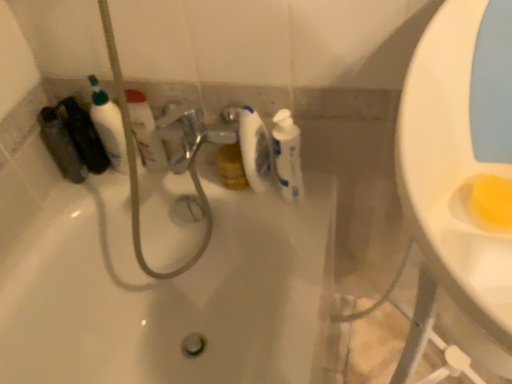
At what (x,y) coordinates should I click in order to perform the action: click on white glossy bottle at center, marked as the first cleaning product in a right-to-left arrangement. Please return your answer as a coordinate pair (x, y). This screenshot has height=384, width=512. Looking at the image, I should click on (287, 155).

This screenshot has height=384, width=512. I want to click on white glossy toilet paper at center, so click(254, 149).

In order to face white glossy bottle at upper left, arranged as the 1th cleaning product when viewed from the left, should I rotate leftwards or rightwards?

Turn left by 15.005 degrees to look at white glossy bottle at upper left, arranged as the 1th cleaning product when viewed from the left.

Describe the element at coordinates (145, 131) in the screenshot. I see `white glossy bottle at upper left, arranged as the 1th cleaning product when viewed from the left` at that location.

At what (x,y) coordinates should I click in order to perform the action: click on white glossy bottle at center, the second cleaning product from the left. Please return your answer as a coordinate pair (x, y). The width and height of the screenshot is (512, 384). Looking at the image, I should click on (287, 155).

Can you confirm if translucent plastic mouthwash at left is smaller than white glossy toilet paper at center?

Actually, translucent plastic mouthwash at left might be larger than white glossy toilet paper at center.

Is translucent plastic mouthwash at left positioned far away from white glossy toilet paper at center?

translucent plastic mouthwash at left is near white glossy toilet paper at center, not far away.

Is translucent plastic mouthwash at left facing away from white glossy toilet paper at center?

That's not correct — translucent plastic mouthwash at left is not looking away from white glossy toilet paper at center.

Is point (239, 140) positioned after point (141, 94)?

Yes.

Would you say white glossy toilet paper at center is inside or outside white glossy bottle at upper left, which ranks as the second cleaning product in right-to-left order?

white glossy toilet paper at center cannot be found inside white glossy bottle at upper left, which ranks as the second cleaning product in right-to-left order.

Which is more to the right, white glossy toilet paper at center or white glossy bottle at upper left, arranged as the 1th cleaning product when viewed from the left?

white glossy toilet paper at center is more to the right.

Can you tell me how much white glossy toilet paper at center and white glossy bottle at upper left, which ranks as the second cleaning product in right-to-left order, differ in facing direction?

The angle between the facing direction of white glossy toilet paper at center and the facing direction of white glossy bottle at upper left, which ranks as the second cleaning product in right-to-left order, is 0.128 degrees.

Can you confirm if translucent plastic mouthwash at left is bigger than white glossy bottle at upper left, which ranks as the second cleaning product in right-to-left order?

Correct, translucent plastic mouthwash at left is larger in size than white glossy bottle at upper left, which ranks as the second cleaning product in right-to-left order.

Is translucent plastic mouthwash at left shorter than white glossy bottle at upper left, which ranks as the second cleaning product in right-to-left order?

Yes.

From the translucent plastic mouthwash at left, count 1st cleaning product to the right and point to it. Please provide its 2D coordinates.

[(145, 131)]

Between white glossy toilet paper at center and white glossy bottle at center, marked as the first cleaning product in a right-to-left arrangement, which one has more height?

white glossy toilet paper at center.

Is white glossy toilet paper at center not near white glossy bottle at center, marked as the first cleaning product in a right-to-left arrangement?

Actually, white glossy toilet paper at center and white glossy bottle at center, marked as the first cleaning product in a right-to-left arrangement, are a little close together.

Identify the location of toilet paper above the white glossy bottle at center, marked as the first cleaning product in a right-to-left arrangement (from a real-world perspective). (254, 149).

Is white glossy bottle at upper left, arranged as the 1th cleaning product when viewed from the left, completely or partially outside of translucent plastic mouthwash at left?

Yes.

From a real-world perspective, who is located lower, white glossy bottle at upper left, which ranks as the second cleaning product in right-to-left order, or translucent plastic mouthwash at left?

In real-world perspective, translucent plastic mouthwash at left is lower.

Considering the points (142, 95) and (61, 166), which point is behind, point (142, 95) or point (61, 166)?

Point (61, 166)

From the image's perspective, who appears lower, white glossy bottle at upper left, arranged as the 1th cleaning product when viewed from the left, or translucent plastic mouthwash at left?

translucent plastic mouthwash at left, from the image's perspective.

Would you consider white glossy toilet paper at center to be distant from translucent plastic mouthwash at left?

No.

In the image, is white glossy toilet paper at center positioned in front of or behind translucent plastic mouthwash at left?

In the image, white glossy toilet paper at center appears in front of translucent plastic mouthwash at left.

Considering the positions of point (258, 121) and point (80, 181), is point (258, 121) closer or farther from the camera than point (80, 181)?

Point (258, 121).

Which of these two, white glossy toilet paper at center or translucent plastic mouthwash at left, stands taller?

white glossy toilet paper at center.

Which is more to the left, white glossy bathtub at center or white glossy bottle at center, the second cleaning product from the left?

white glossy bathtub at center.

Between white glossy bathtub at center and white glossy bottle at center, marked as the first cleaning product in a right-to-left arrangement, which one has smaller size?

With smaller size is white glossy bottle at center, marked as the first cleaning product in a right-to-left arrangement.

Could you tell me if white glossy bathtub at center is facing white glossy bottle at center, the second cleaning product from the left?

No, white glossy bathtub at center is not aimed at white glossy bottle at center, the second cleaning product from the left.

Find the location of a particular element. the 2nd cleaning product located above the white glossy bathtub at center (from a real-world perspective) is located at coordinates pyautogui.click(x=287, y=155).

Where is `mouthwash lying above the white glossy toilet paper at center (from the image's perspective)`? The height and width of the screenshot is (384, 512). mouthwash lying above the white glossy toilet paper at center (from the image's perspective) is located at coordinates (61, 145).

Locate an element on the screen. This screenshot has height=384, width=512. cleaning product on the left of white glossy toilet paper at center is located at coordinates (145, 131).

Based on their spatial positions, is translucent plastic mouthwash at left or white glossy bottle at center, the second cleaning product from the left, closer to white glossy toilet paper at center?

The object closer to white glossy toilet paper at center is white glossy bottle at center, the second cleaning product from the left.

Based on their spatial positions, is translucent plastic mouthwash at left or white glossy bottle at center, marked as the first cleaning product in a right-to-left arrangement, closer to white glossy bathtub at center?

Based on the image, white glossy bottle at center, marked as the first cleaning product in a right-to-left arrangement, appears to be nearer to white glossy bathtub at center.

Estimate the real-world distances between objects in this image. Which object is closer to white glossy bathtub at center, translucent plastic mouthwash at left or white glossy toilet paper at center?

white glossy toilet paper at center.

From the image, which object appears to be nearer to white glossy toilet paper at center, white glossy bottle at center, marked as the first cleaning product in a right-to-left arrangement, or translucent plastic mouthwash at left?

white glossy bottle at center, marked as the first cleaning product in a right-to-left arrangement, is positioned closer to the anchor white glossy toilet paper at center.

Looking at this image, which object lies further to the anchor point white glossy bottle at upper left, arranged as the 1th cleaning product when viewed from the left, white glossy bathtub at center or translucent plastic mouthwash at left?

white glossy bathtub at center is further to white glossy bottle at upper left, arranged as the 1th cleaning product when viewed from the left.

Which object lies nearer to the anchor point white glossy bottle at upper left, arranged as the 1th cleaning product when viewed from the left, white glossy toilet paper at center or white glossy bottle at center, marked as the first cleaning product in a right-to-left arrangement?

white glossy toilet paper at center.

Which object lies nearer to the anchor point translucent plastic mouthwash at left, white glossy bottle at upper left, which ranks as the second cleaning product in right-to-left order, or white glossy toilet paper at center?

The object closer to translucent plastic mouthwash at left is white glossy bottle at upper left, which ranks as the second cleaning product in right-to-left order.

From the picture: Which object lies nearer to the anchor point white glossy bottle at center, the second cleaning product from the left, white glossy toilet paper at center or white glossy bathtub at center?

Based on the image, white glossy toilet paper at center appears to be nearer to white glossy bottle at center, the second cleaning product from the left.

This screenshot has height=384, width=512. Identify the location of cleaning product between white glossy bottle at upper left, which ranks as the second cleaning product in right-to-left order, and white glossy bathtub at center in the up-down direction. (287, 155).

Where is `bathtub between translucent plastic mouthwash at left and white glossy bottle at center, marked as the first cleaning product in a right-to-left arrangement, in the horizontal direction`? bathtub between translucent plastic mouthwash at left and white glossy bottle at center, marked as the first cleaning product in a right-to-left arrangement, in the horizontal direction is located at coordinates (172, 296).

You are a GUI agent. You are given a task and a screenshot of the screen. Output one action in this format:
    pyautogui.click(x=<x>, y=<y>)
    Task: Click on the toilet paper between white glossy bottle at upper left, which ranks as the second cleaning product in right-to-left order, and white glossy bathtub at center, in the vertical direction
    This screenshot has width=512, height=384.
    Given the screenshot: What is the action you would take?
    pyautogui.click(x=254, y=149)

Image resolution: width=512 pixels, height=384 pixels. Identify the location of toilet paper between white glossy bottle at upper left, which ranks as the second cleaning product in right-to-left order, and white glossy bottle at center, the second cleaning product from the left, in the horizontal direction. (254, 149).